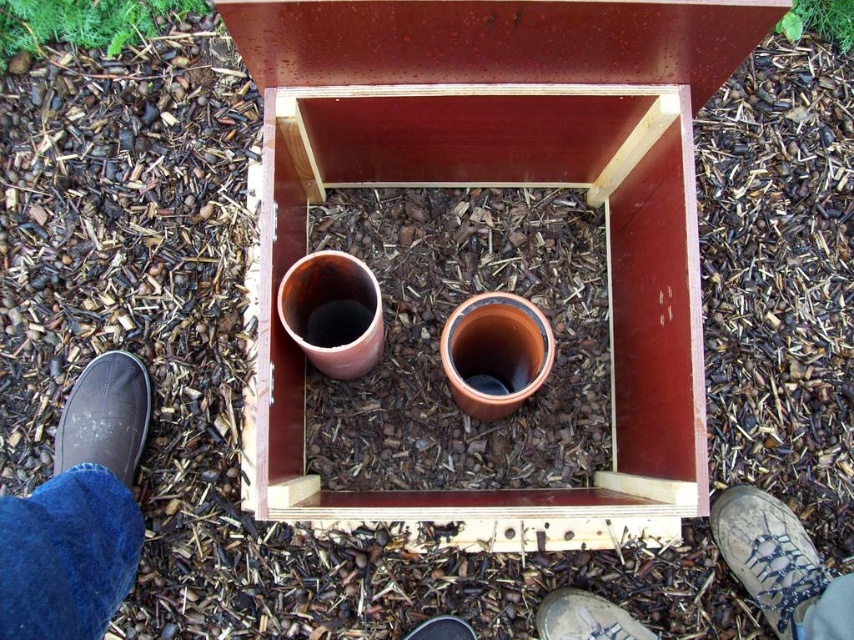
You are a gardener standing in front of the wooden box with two terracotta pots. You need to place a new plant in one of the pots. However, you notice two people standing nearby. Where are the camouflage fabric boot at lower right and the black leather shoe at lower center located relative to each other? Could this affect your access to the pots?

The camouflage fabric boot at lower right is positioned on the right side of the black leather shoe at lower center. This means the two shoes are close to each other near the lower part of the frame, potentially blocking access to the pots if they are positioned near the same area.

You are standing in a garden and see the dark blue denim jeans at lower left and the dark gray canvas shoe at lower left. Which item is located more to the right side?

The dark blue denim jeans at lower left is positioned on the right side of dark gray canvas shoe at lower left, so the dark blue denim jeans at lower left is more to the right side.

Looking at this image, you are a photographer trying to capture the wooden box with the two terracotta pots. You notice the dark blue denim jeans at lower left and the dark gray canvas shoe at lower left in the frame. Which of these items is bigger in size?

The dark blue denim jeans at lower left is larger in size than the dark gray canvas shoe at lower left.